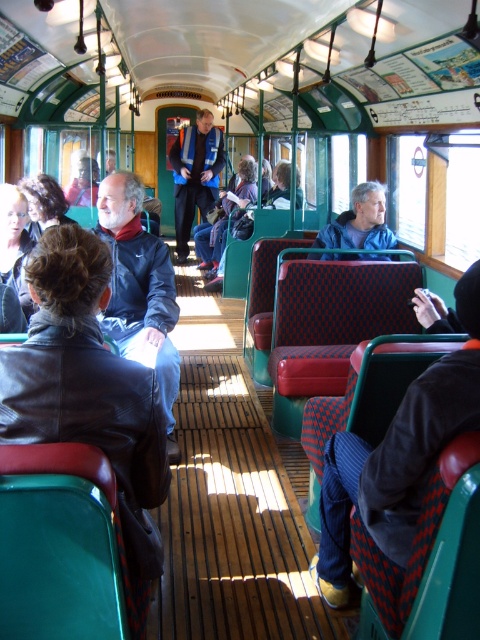
Does point (391, 436) lie in front of point (375, 221)?

That is True.

Which is in front, point (335, 506) or point (384, 204)?

Positioned in front is point (335, 506).

Is point (368, 513) positioned after point (327, 241)?

No, it is in front of (327, 241).

Find the location of a particular element. This screenshot has height=640, width=480. dark blue corduroy pants at center is located at coordinates (397, 458).

Is dark blue corduroy pants at center shorter than reflective silver coach at center?

Yes.

Is point (344, 524) farther from viewer compared to point (182, 237)?

That is False.

What are the coordinates of `dark blue corduroy pants at center` in the screenshot? It's located at (397, 458).

Is point (121, 298) farther from viewer compared to point (194, 129)?

No, (121, 298) is closer to viewer.

Which is above, matte black jacket at left or reflective silver coach at center?

Positioned higher is reflective silver coach at center.

Which is in front, point (131, 211) or point (212, 202)?

Point (131, 211) is more forward.

Where is `matte black jacket at left`? Image resolution: width=480 pixels, height=640 pixels. matte black jacket at left is located at coordinates (140, 288).